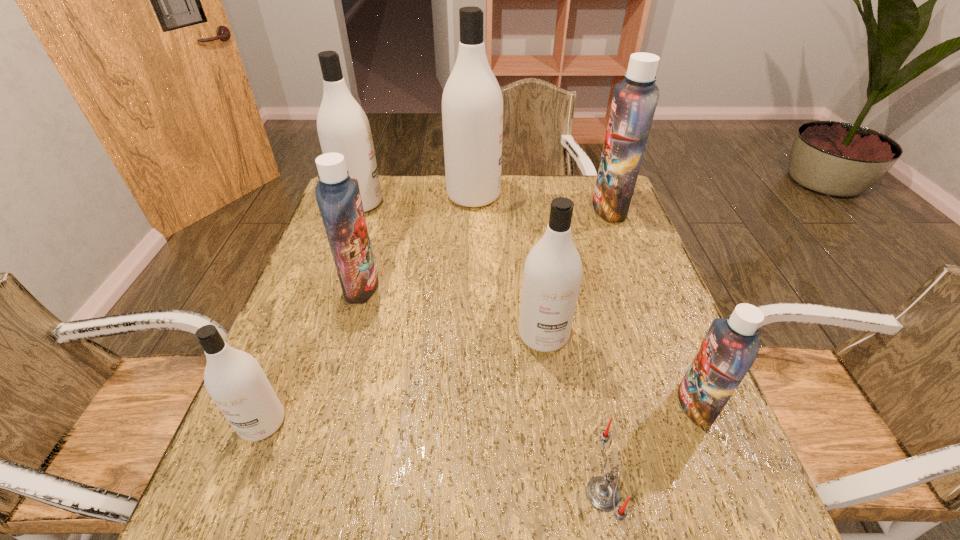
At what (x,y) coordinates should I click in order to perform the action: click on vacant position located on the front label of the smallest blue shampoo. Please return your answer as a coordinate pair (x, y). Image resolution: width=960 pixels, height=540 pixels. Looking at the image, I should click on (515, 404).

Where is `vacant point located 0.230m on the front label of the smallest blue shampoo`? The image size is (960, 540). vacant point located 0.230m on the front label of the smallest blue shampoo is located at coordinates (564, 404).

You are a GUI agent. You are given a task and a screenshot of the screen. Output one action in this format:
    pyautogui.click(x=<x>, y=<y>)
    Task: Click on the vacant space situated 0.140m on the front-facing side of the nearest white shampoo
    The image size is (960, 540).
    Given the screenshot: What is the action you would take?
    pyautogui.click(x=222, y=526)

At what (x,y) coordinates should I click in order to perform the action: click on vacant space located 0.150m on the front-facing side of the shortest object. Please return your answer as a coordinate pair (x, y). This screenshot has height=540, width=960. Looking at the image, I should click on (499, 494).

At what (x,y) coordinates should I click in order to perform the action: click on vacant space located on the front-facing side of the shortest object. Please return your answer as a coordinate pair (x, y). The height and width of the screenshot is (540, 960). Looking at the image, I should click on (377, 494).

In order to click on free location located 0.190m on the front-facing side of the shortest object in this screenshot , I will do `click(476, 494)`.

Locate an element on the screen. object that is positioned at the near edge is located at coordinates (602, 492).

At what (x,y) coordinates should I click in order to perform the action: click on object that is positioned at the far left corner. Please return your answer as a coordinate pair (x, y). Looking at the image, I should click on (343, 127).

Identify the location of object at the far right corner. Image resolution: width=960 pixels, height=540 pixels. (634, 102).

Identify the location of free space at the far edge. The height and width of the screenshot is (540, 960). (557, 183).